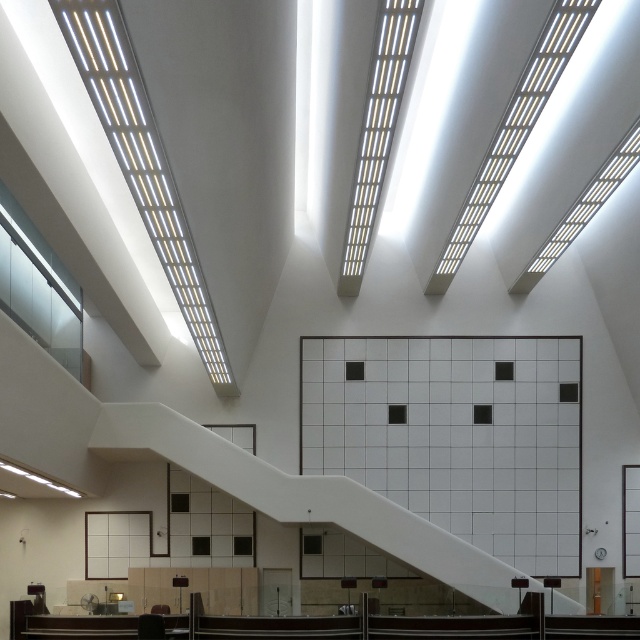
Question: Can you confirm if white tile wall at center is bigger than white glossy staircase at center?

Choices:
 (A) no
 (B) yes

Answer: (A)

Question: Which object appears farthest from the camera in this image?

Choices:
 (A) white tile wall at center
 (B) white glossy staircase at center

Answer: (A)

Question: Which point appears farthest from the camera in this image?

Choices:
 (A) (458, 512)
 (B) (417, 545)

Answer: (A)

Question: Is white tile wall at center to the right of white glossy staircase at center from the viewer's perspective?

Choices:
 (A) no
 (B) yes

Answer: (B)

Question: Can you confirm if white tile wall at center is positioned below white glossy staircase at center?

Choices:
 (A) yes
 (B) no

Answer: (B)